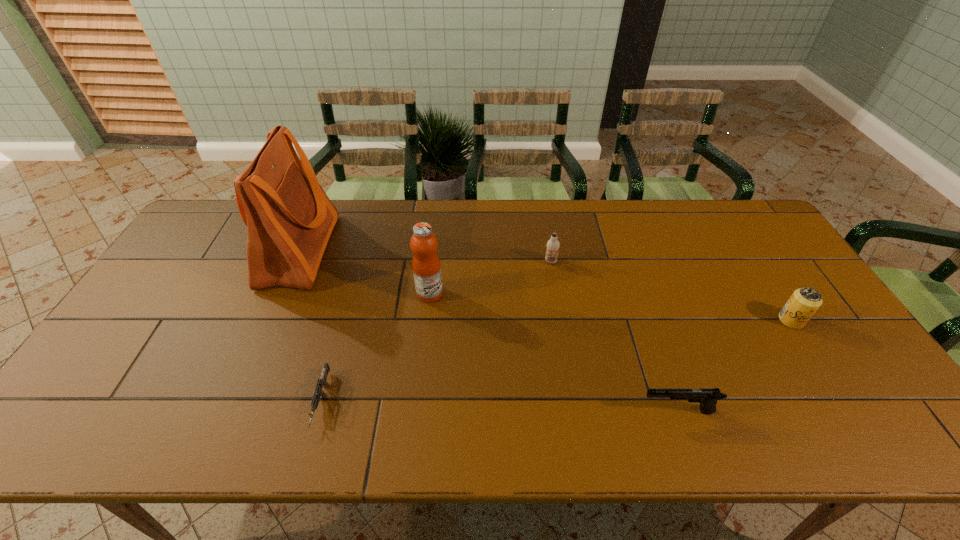
Image resolution: width=960 pixels, height=540 pixels. Identify the location of the shortest object. (321, 382).

This screenshot has width=960, height=540. In order to click on vacant space located 0.250m on the front pocket of the shopping bag in this screenshot , I will do `click(410, 251)`.

Where is `vacant space located 0.240m on the front label of the second tallest object`? Image resolution: width=960 pixels, height=540 pixels. vacant space located 0.240m on the front label of the second tallest object is located at coordinates (526, 293).

Locate an element on the screen. Image resolution: width=960 pixels, height=540 pixels. blank space located on the left of the chocolate milk is located at coordinates (425, 261).

Locate an element on the screen. Image resolution: width=960 pixels, height=540 pixels. vacant area located 0.080m on the back of the rightmost object is located at coordinates (772, 291).

Find the location of a particular element. free space located at the aiming end of the second object from right to left is located at coordinates (484, 411).

Identify the location of blank space located at the aiming end of the second object from right to left. (470, 411).

Where is `free spot located at the aiming end of the second object from right to left`? This screenshot has width=960, height=540. free spot located at the aiming end of the second object from right to left is located at coordinates (510, 411).

Identify the location of object that is at the far edge. (289, 218).

Where is `object at the right edge`? object at the right edge is located at coordinates (804, 302).